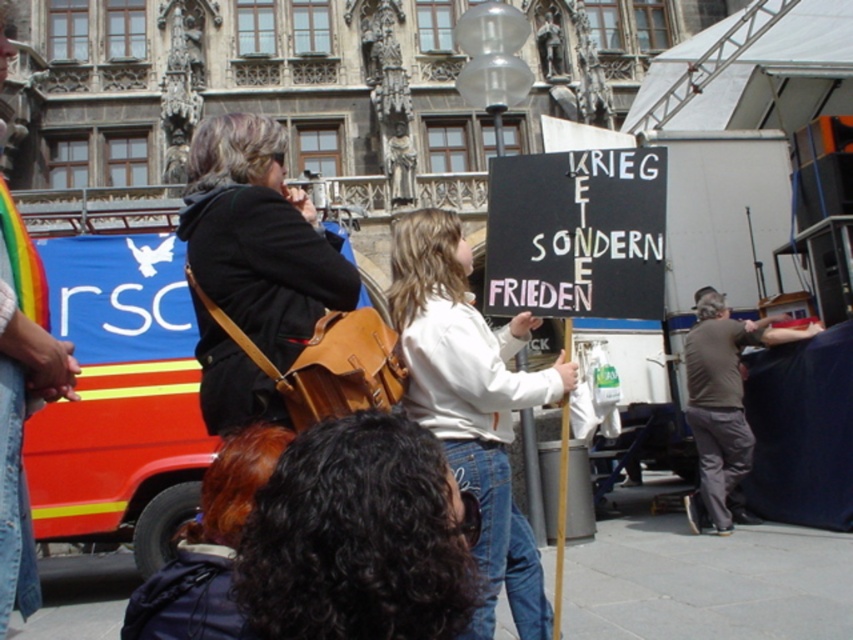
Based on the photo, you are a photographer standing in the crowd at the event. You want to take a photo that includes both the white cotton shirt at center and the black chalkboard at center. Based on their positions, which object should you place on the left side of your photo frame?

The white cotton shirt at center is positioned on the left side of the black chalkboard at center, so to include both in the photo, you should place the white cotton shirt at center on the left side of your frame.

You are a photographer trying to capture a clear shot of both the black curly hair at center and the brown cotton shirt at right. Based on their positions, which one should you focus on first to ensure both are in the frame?

You should focus on the black curly hair at center first because it is in front of the brown cotton shirt at right, so adjusting the camera to include the foreground subject will naturally include the background one as well.

You are part of the crowd in the scene and want to identify the speaker. Which of the two people at center, the matte black jacket at center or the white cotton shirt at center, is more likely the one holding the microphone based on their size?

The matte black jacket at center has a larger size compared to the white cotton shirt at center, so the person wearing the matte black jacket at center is more likely the one holding the microphone as they appear larger in the scene.